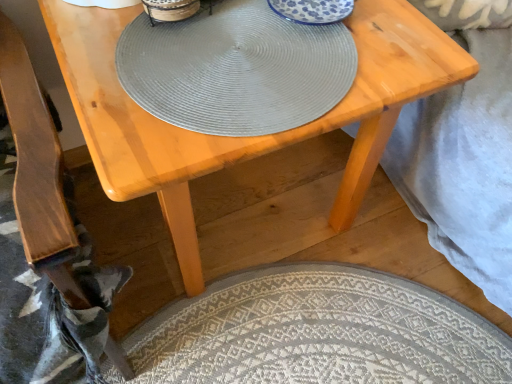
Where is `vacant area to the left of matte gray placemat at center`? The height and width of the screenshot is (384, 512). vacant area to the left of matte gray placemat at center is located at coordinates (101, 26).